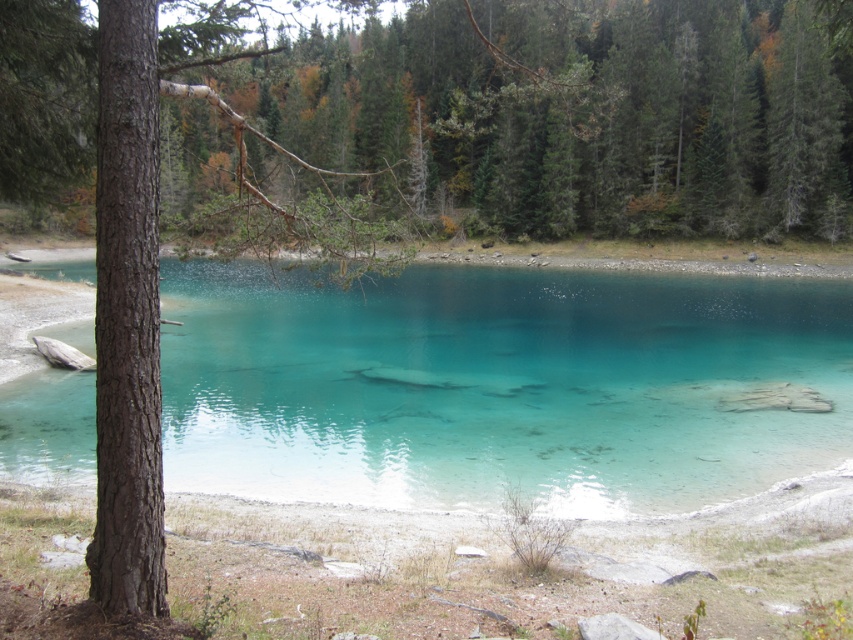
Which is more to the right, clear glassy water at center or green matte tree at upper center?

green matte tree at upper center is more to the right.

Who is more distant from viewer, (521,426) or (601,220)?

The point (601,220) is behind.

At what (x,y) coordinates should I click in order to perform the action: click on clear glassy water at center. Please return your answer as a coordinate pair (x, y). This screenshot has width=853, height=640. Looking at the image, I should click on (500, 385).